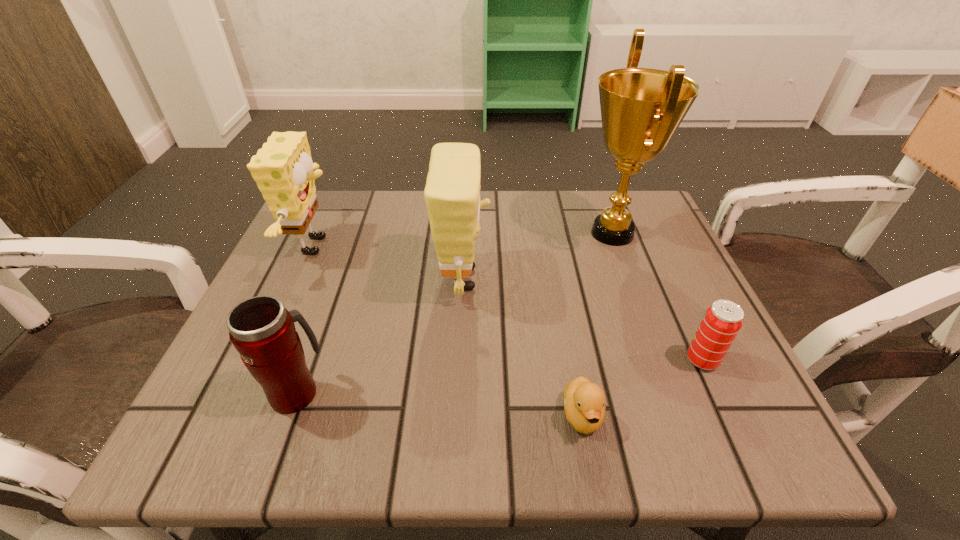
Image resolution: width=960 pixels, height=540 pixels. What are the coordinates of `vacant space that's between the thermos bottle and the left sponge` in the screenshot? It's located at (307, 319).

In order to click on object that stands as the closest to the right sponge in this screenshot , I will do `click(584, 402)`.

Locate an element on the screen. object that is the third closest to the left sponge is located at coordinates (584, 402).

This screenshot has width=960, height=540. I want to click on vacant space that satisfies the following two spatial constraints: 1. on the front view with handles of the tallest object; 2. facing forward on the third object from right to left, so click(x=681, y=415).

Where is `free space that satisfies the following two spatial constraints: 1. on the front view with handles of the tallest object; 2. facing forward on the shortest object`? This screenshot has height=540, width=960. free space that satisfies the following two spatial constraints: 1. on the front view with handles of the tallest object; 2. facing forward on the shortest object is located at coordinates (681, 415).

Locate an element on the screen. This screenshot has height=540, width=960. vacant space that satisfies the following two spatial constraints: 1. on the front-facing side of the left sponge; 2. on the back side of the second shortest object is located at coordinates tap(267, 360).

This screenshot has width=960, height=540. Find the location of `blank space that satisfies the following two spatial constraints: 1. on the face of the fifth tallest object; 2. on the right side of the third object from left to right`. blank space that satisfies the following two spatial constraints: 1. on the face of the fifth tallest object; 2. on the right side of the third object from left to right is located at coordinates (460, 360).

Find the location of `free location that satisfies the following two spatial constraints: 1. on the front-facing side of the left sponge; 2. on the side with the handle of the fourth tallest object`. free location that satisfies the following two spatial constraints: 1. on the front-facing side of the left sponge; 2. on the side with the handle of the fourth tallest object is located at coordinates (252, 392).

Where is `free spot that satisfies the following two spatial constraints: 1. on the face of the right sponge; 2. on the left side of the soda can`? free spot that satisfies the following two spatial constraints: 1. on the face of the right sponge; 2. on the left side of the soda can is located at coordinates (460, 360).